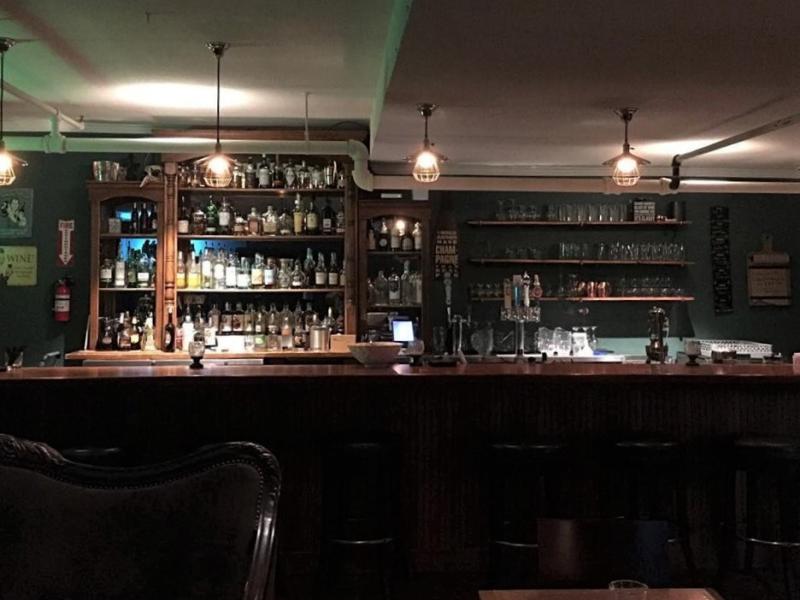
Identify the location of light fixture. This screenshot has height=600, width=800. (630, 171), (430, 165), (224, 162), (16, 179).